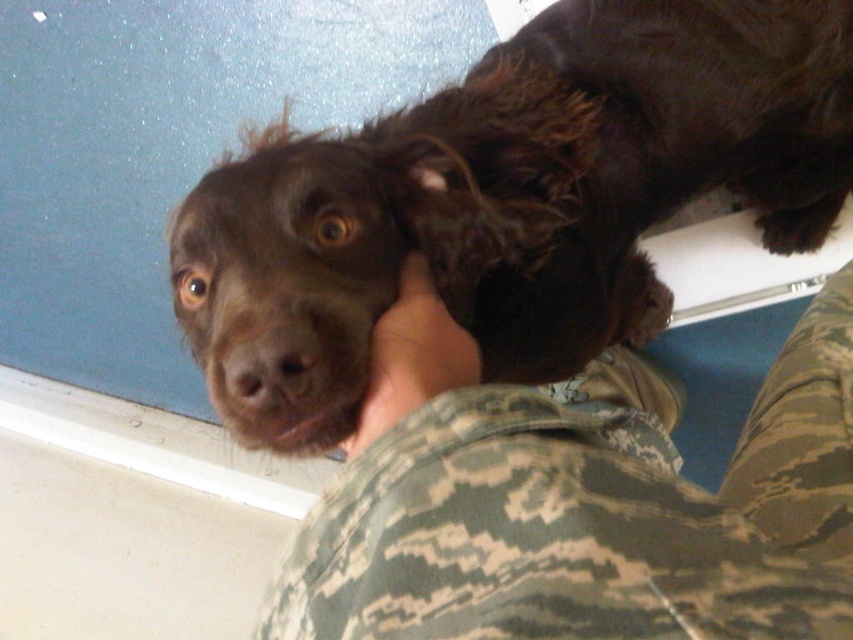
Question: Is brown furry dog at center above camo fabric shirt at center?

Choices:
 (A) yes
 (B) no

Answer: (A)

Question: Does brown furry dog at center have a larger size compared to camo fabric shirt at center?

Choices:
 (A) no
 (B) yes

Answer: (B)

Question: Which is nearer to the camo fabric shirt at center?

Choices:
 (A) brown furry paw at center
 (B) brown furry dog at center

Answer: (A)

Question: Which object is closer to the camera taking this photo?

Choices:
 (A) brown furry paw at center
 (B) camo fabric shirt at center
 (C) brown furry dog at center

Answer: (B)

Question: Which of the following is the farthest from the observer?

Choices:
 (A) (534, 611)
 (B) (422, 314)
 (C) (492, 189)

Answer: (C)

Question: Is camo fabric shirt at center to the left of brown furry paw at center from the viewer's perspective?

Choices:
 (A) no
 (B) yes

Answer: (A)